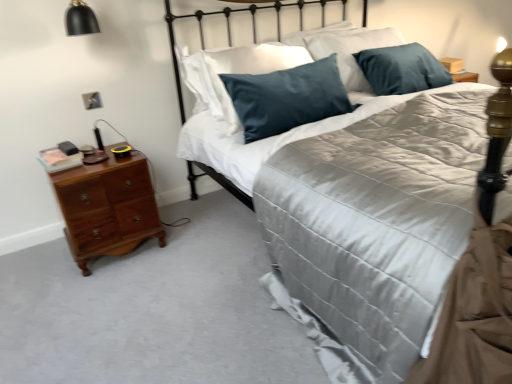
Identify the location of vacant area in front of cherry wood nightstand at left. The height and width of the screenshot is (384, 512). (95, 289).